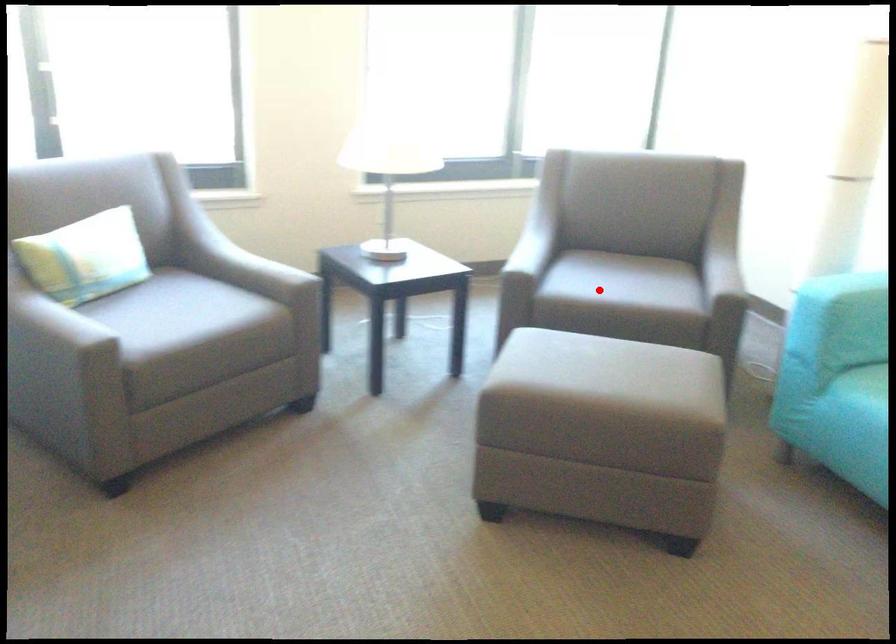
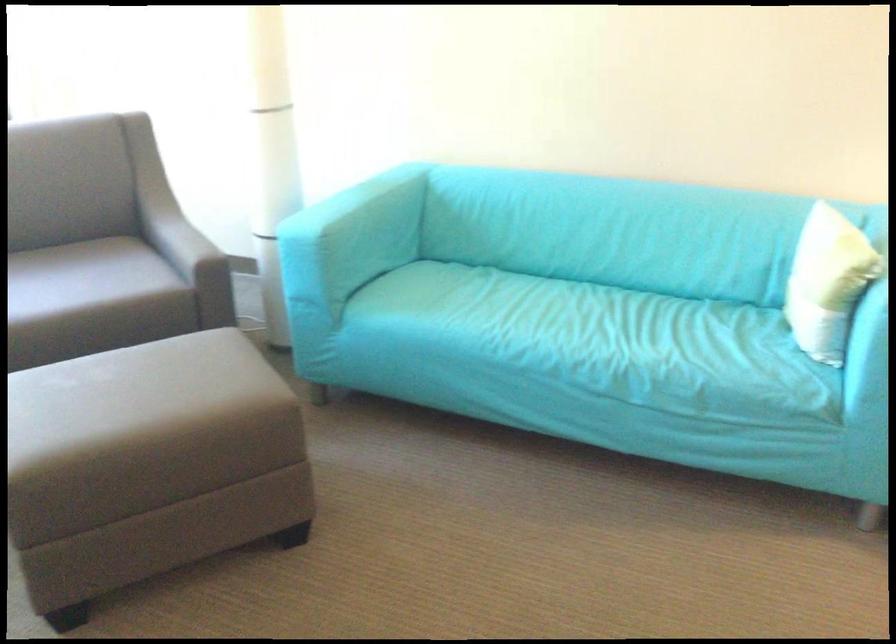
Question: I am providing you with two images of the same scene from different viewpoints. Image1 has a red point marked. In image2, the corresponding 3D location appears at what relative position? Reply with the corresponding letter.

Choices:
 (A) Closer
 (B) Farther

Answer: (A)